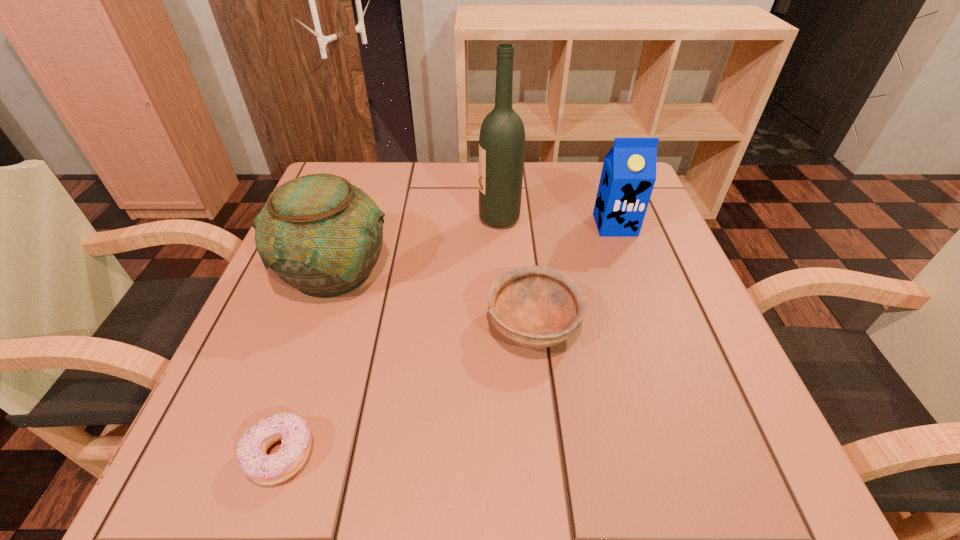
Where is `object that is at the far right corner`? The image size is (960, 540). object that is at the far right corner is located at coordinates coord(628,176).

Locate an element on the screen. The height and width of the screenshot is (540, 960). free region at the far edge of the desktop is located at coordinates (444, 186).

The height and width of the screenshot is (540, 960). I want to click on vacant space at the near edge of the desktop, so click(x=386, y=437).

Locate an element on the screen. vacant space at the left edge of the desktop is located at coordinates pos(330,360).

Locate an element on the screen. The width and height of the screenshot is (960, 540). vacant point at the right edge is located at coordinates (662, 288).

You are a GUI agent. You are given a task and a screenshot of the screen. Output one action in this format:
    pyautogui.click(x=<x>, y=<y>)
    Task: Click on the vacant space at the far left corner
    Image resolution: width=960 pixels, height=540 pixels.
    Given the screenshot: What is the action you would take?
    pyautogui.click(x=356, y=178)

Locate an element on the screen. free location at the far right corner is located at coordinates (648, 206).

Where is `empty location between the pottery and the doughnut`? The height and width of the screenshot is (540, 960). empty location between the pottery and the doughnut is located at coordinates (307, 363).

Image resolution: width=960 pixels, height=540 pixels. What are the coordinates of `free space between the wine bottle and the pottery` in the screenshot? It's located at (417, 245).

Locate an element on the screen. Image resolution: width=960 pixels, height=540 pixels. free area in between the wine bottle and the doughnut is located at coordinates (390, 337).